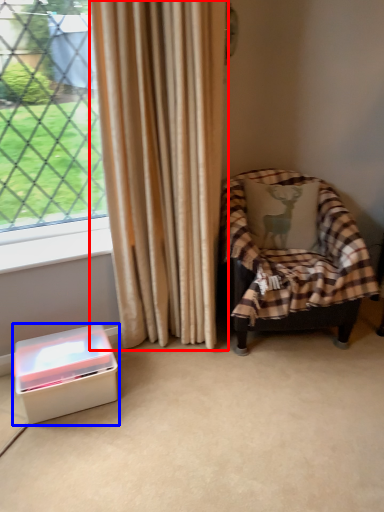
Question: Which point is closer to the camera, curtain (highlighted by a red box) or box (highlighted by a blue box)?

Choices:
 (A) curtain
 (B) box

Answer: (A)